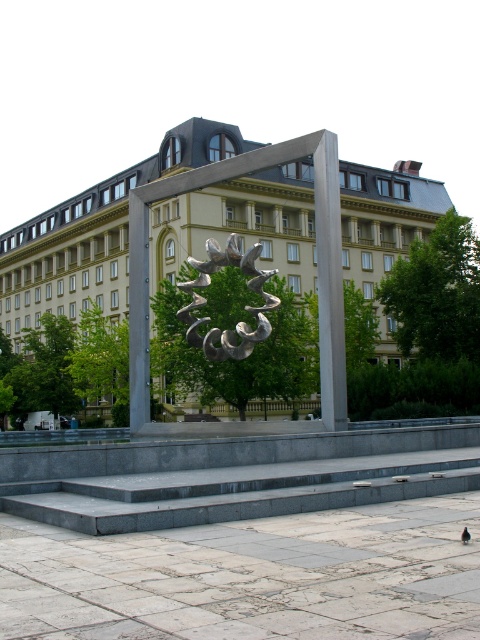
Question: Does satin silver sculpture at center have a greater width compared to brown feathered pigeon at center?

Choices:
 (A) no
 (B) yes

Answer: (B)

Question: Which point is closer to the camera taking this photo?

Choices:
 (A) (210, 276)
 (B) (460, 536)

Answer: (B)

Question: Is satin silver sculpture at center closer to camera compared to brown feathered pigeon at center?

Choices:
 (A) yes
 (B) no

Answer: (B)

Question: Does satin silver sculpture at center come behind brown feathered pigeon at center?

Choices:
 (A) no
 (B) yes

Answer: (B)